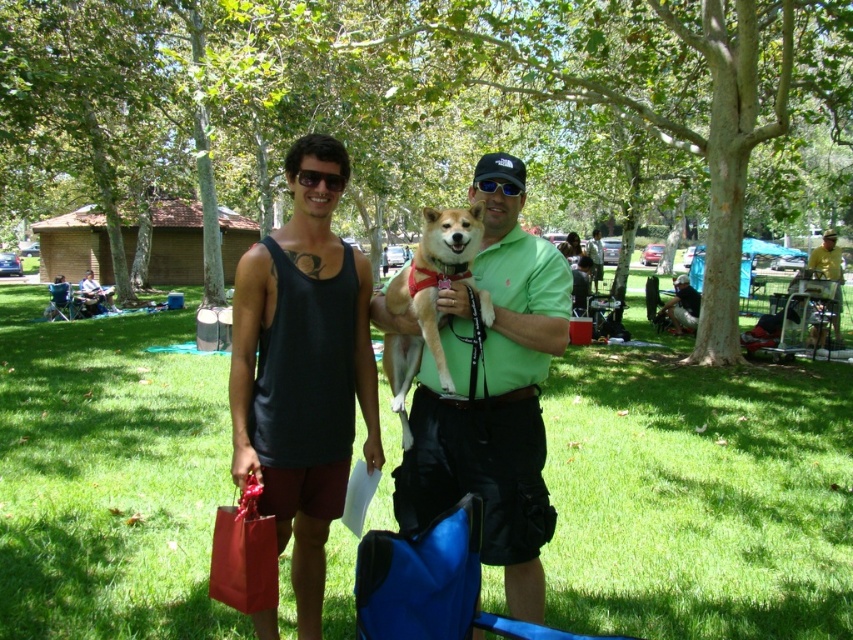
Is light brown fur at center to the right of green matte shirt at center from the viewer's perspective?

No, light brown fur at center is not to the right of green matte shirt at center.

Consider the image. Does light brown fur at center have a larger size compared to green matte shirt at center?

Actually, light brown fur at center might be smaller than green matte shirt at center.

Find the location of `light brown fur at center`. light brown fur at center is located at coordinates (428, 298).

Does black tank top at center have a lesser height compared to matte black tank top at center?

No, black tank top at center is not shorter than matte black tank top at center.

Is black tank top at center bigger than matte black tank top at center?

Incorrect, black tank top at center is not larger than matte black tank top at center.

Identify the location of black tank top at center. This screenshot has width=853, height=640. pyautogui.click(x=303, y=369).

Between green cotton shirt at center and sunglasses at center, which one is positioned lower?

green cotton shirt at center is below.

Is green cotton shirt at center wider than sunglasses at center?

Yes, green cotton shirt at center is wider than sunglasses at center.

Is point (527, 524) positioned before point (474, 180)?

Yes, it is.

Identify the location of green cotton shirt at center. Image resolution: width=853 pixels, height=640 pixels. (492, 396).